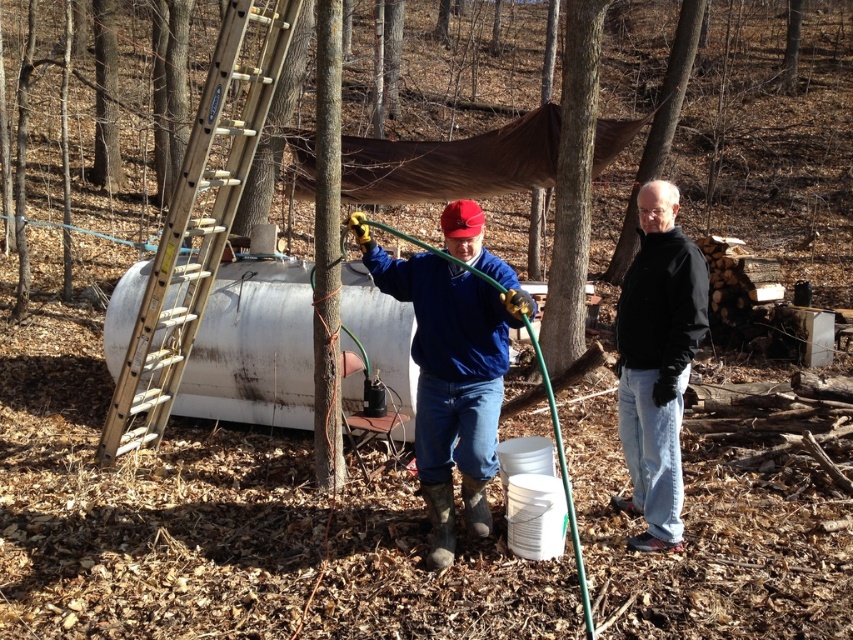
Is rough bark tree at center thinner than brown rough bark at upper center?

Correct, rough bark tree at center's width is less than brown rough bark at upper center's.

Describe the element at coordinates (572, 186) in the screenshot. I see `rough bark tree at center` at that location.

The image size is (853, 640). What do you see at coordinates (572, 186) in the screenshot?
I see `rough bark tree at center` at bounding box center [572, 186].

This screenshot has height=640, width=853. I want to click on rough bark tree at center, so (572, 186).

Does blue matte jacket at center have a greater width compared to black matte jacket at center?

Yes.

Does point (486, 388) lie in front of point (677, 467)?

Yes, point (486, 388) is in front of point (677, 467).

Where is `blue matte jacket at center`? blue matte jacket at center is located at coordinates (453, 362).

Identify the location of black matte jacket at center. This screenshot has width=853, height=640. (657, 362).

Can you confirm if black matte jacket at center is positioned to the right of brown rough bark at upper center?

Incorrect, black matte jacket at center is not on the right side of brown rough bark at upper center.

Describe the element at coordinates (657, 362) in the screenshot. I see `black matte jacket at center` at that location.

Find the location of a particular element. black matte jacket at center is located at coordinates (657, 362).